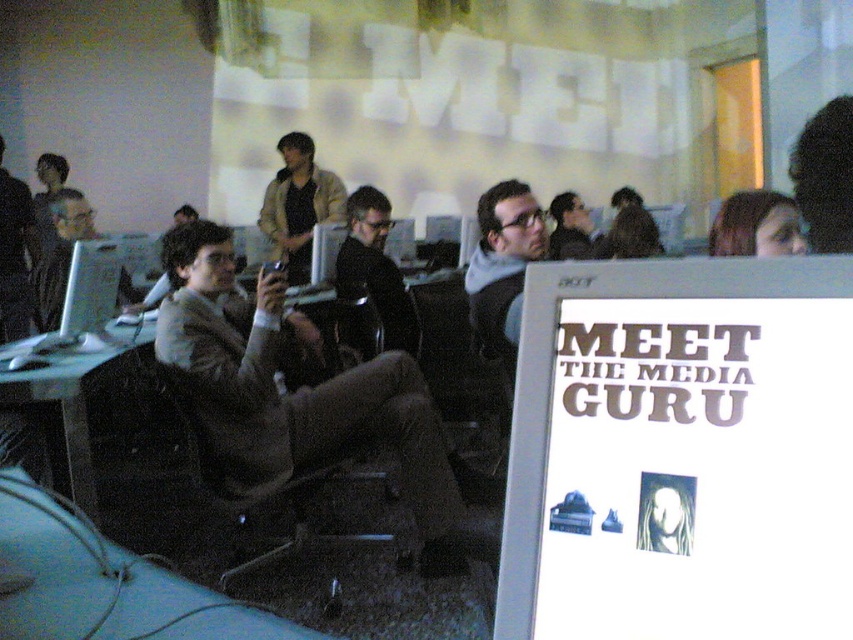
You are a guest at this event and want to sit down. The light blue fabric couch at lower left and dark brown hair at upper right are both available. Which one is wider so you can sit comfortably?

The light blue fabric couch at lower left is wider than the dark brown hair at upper right, so you can sit comfortably there.

You are at the event and need to locate the dark brown leather jacket at center and the tan leather jacket at center. Which one is positioned to the right of the other?

The dark brown leather jacket at center is to the right of the tan leather jacket at center.

You are organizing a photo shoot and need to place two items, the dark brown leather jacket at center and the gray sweater at center, on a mannequin. The mannequin has a limited space between its shoulders. If the space between the mannequin shoulders is 22 inches, will both items fit side by side?

The dark brown leather jacket at center and gray sweater at center are 23.30 inches apart from each other. Since the space between the mannequin shoulders is only 22 inches, the items will not fit side by side as they require more space than available.